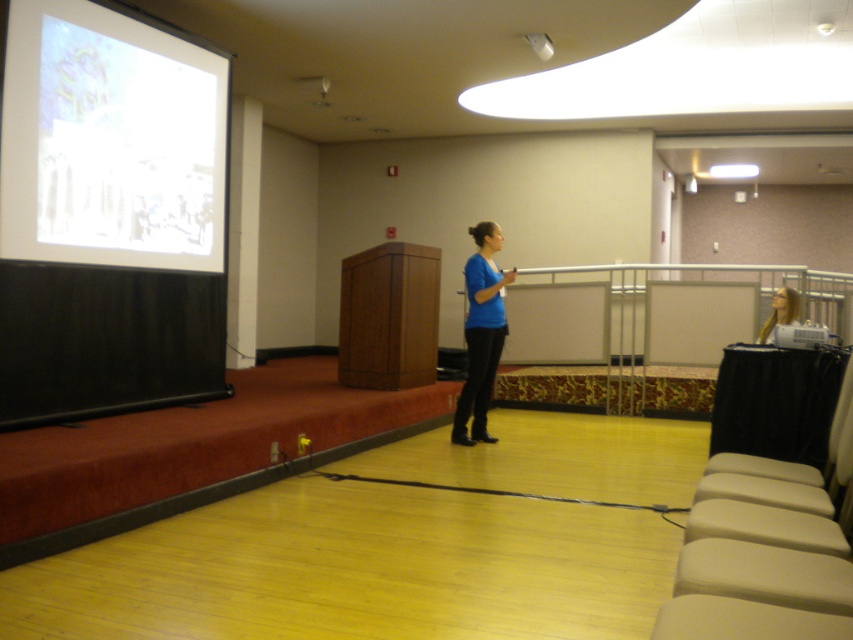
Is point (28, 93) less distant than point (816, 339)?

No, it is not.

Looking at this image, between white glossy projection screen at upper left and metallic gray projector at lower right, which one has less height?

metallic gray projector at lower right is shorter.

Is point (160, 99) behind point (815, 324)?

Yes, point (160, 99) is farther from viewer.

This screenshot has height=640, width=853. I want to click on white glossy projection screen at upper left, so click(109, 140).

Does blonde hair at upper right have a greater width compared to metallic gray projector at lower right?

Yes.

Where is `blonde hair at upper right`? This screenshot has width=853, height=640. blonde hair at upper right is located at coordinates (780, 314).

Locate an element on the screen. The height and width of the screenshot is (640, 853). blonde hair at upper right is located at coordinates (780, 314).

Does blue matte shirt at center have a larger size compared to blonde hair at upper right?

Yes.

Is blue matte shirt at center wider than blonde hair at upper right?

No, blue matte shirt at center is not wider than blonde hair at upper right.

At what (x,y) coordinates should I click in order to perform the action: click on blue matte shirt at center. Please return your answer as a coordinate pair (x, y). Looking at the image, I should click on (480, 332).

Image resolution: width=853 pixels, height=640 pixels. Find the location of `blue matte shirt at center`. blue matte shirt at center is located at coordinates (480, 332).